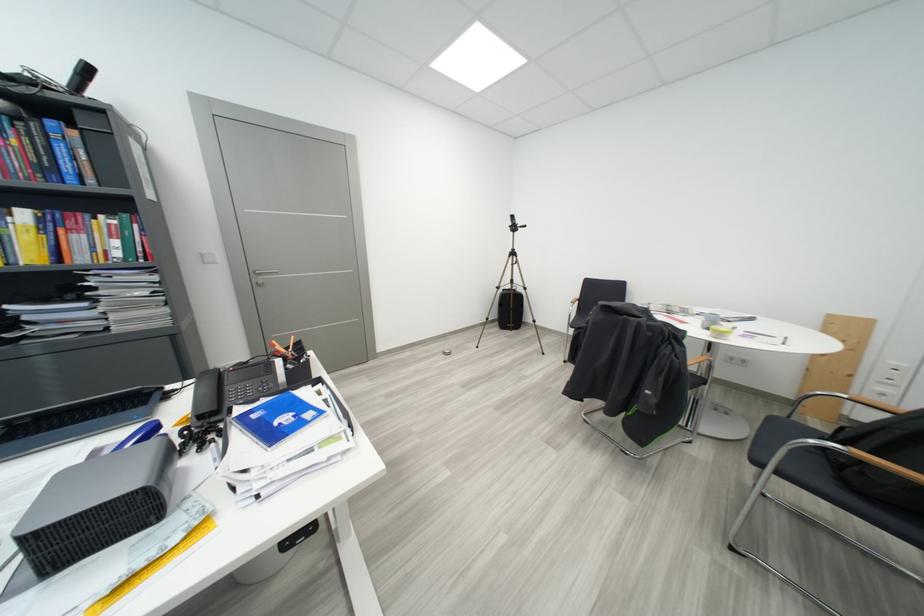
Find where to push the white light switch. Please return your answer as a coordinate pair (x, y).

(892, 373)